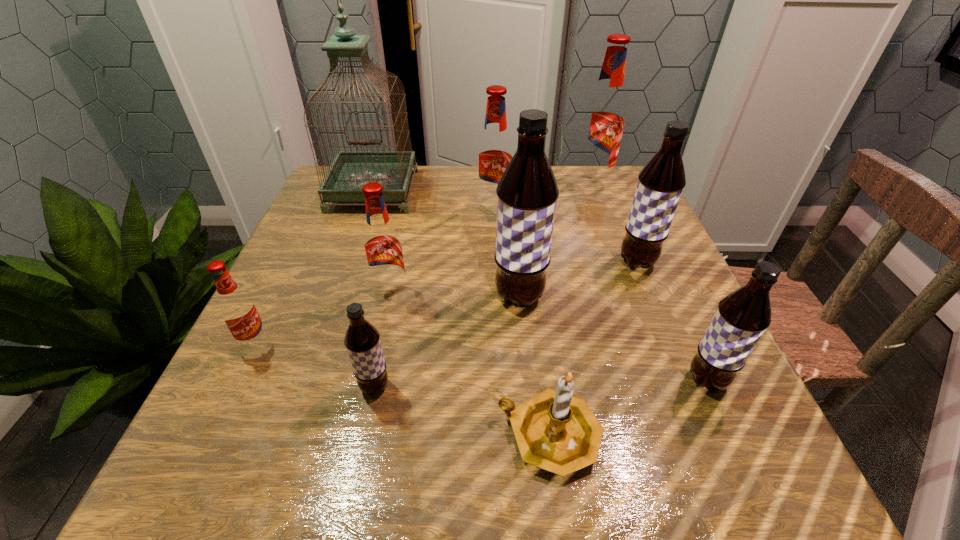
Identify which root beer is the seventh nearest to the third brown root beer from right to left. Please provide its 2D coordinates. Your answer should be formatted as a tuple, i.e. [(x, y)], where the tuple contains the x and y coordinates of a point satisfying the conditions above.

[(236, 307)]

Identify the location of the third closest brown root beer to the candle holder. The height and width of the screenshot is (540, 960). (362, 340).

Identify which brown root beer is the closest to the nearest red root beer. Please provide its 2D coordinates. Your answer should be formatted as a tuple, i.e. [(x, y)], where the tuple contains the x and y coordinates of a point satisfying the conditions above.

[(362, 340)]

The image size is (960, 540). In order to click on the second closest red root beer to the seventh nearest root beer in this screenshot , I will do `click(383, 250)`.

Identify which red root beer is the closest to the smallest red root beer. Please provide its 2D coordinates. Your answer should be formatted as a tuple, i.e. [(x, y)], where the tuple contains the x and y coordinates of a point satisfying the conditions above.

[(383, 250)]

I want to click on blank space that satisfies the following two spatial constraints: 1. on the front side of the candle holder; 2. on the left side of the smallest brown root beer, so click(x=365, y=436).

The image size is (960, 540). Identify the location of free location that satisfies the following two spatial constraints: 1. at the door of the birdcage; 2. on the left side of the smallest brown root beer. (306, 387).